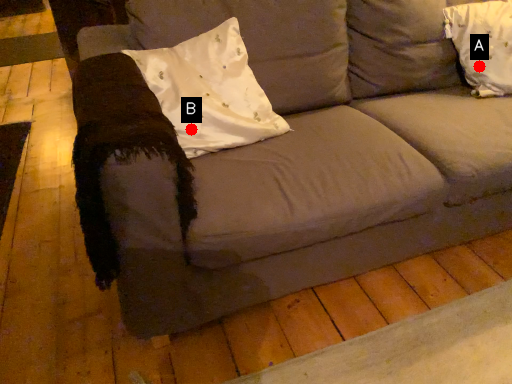
Question: Two points are circled on the image, labeled by A and B beside each circle. Which point is farther from the camera taking this photo?

Choices:
 (A) A is further
 (B) B is further

Answer: (A)